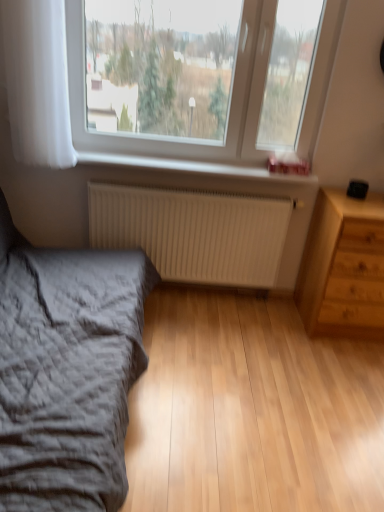
You are a GUI agent. You are given a task and a screenshot of the screen. Output one action in this format:
    pyautogui.click(x=<x>, y=<y>)
    Task: Click on the space that is in front of white matte radiator at lower center
    Image resolution: width=384 pixels, height=512 pixels.
    Given the screenshot: What is the action you would take?
    (x=213, y=359)